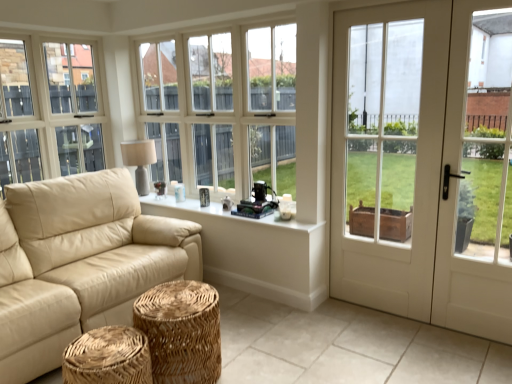
Find the location of a particular element. The image size is (512, 384). free space above matte beige lampshade at upper left (from a real-world perspective) is located at coordinates (136, 144).